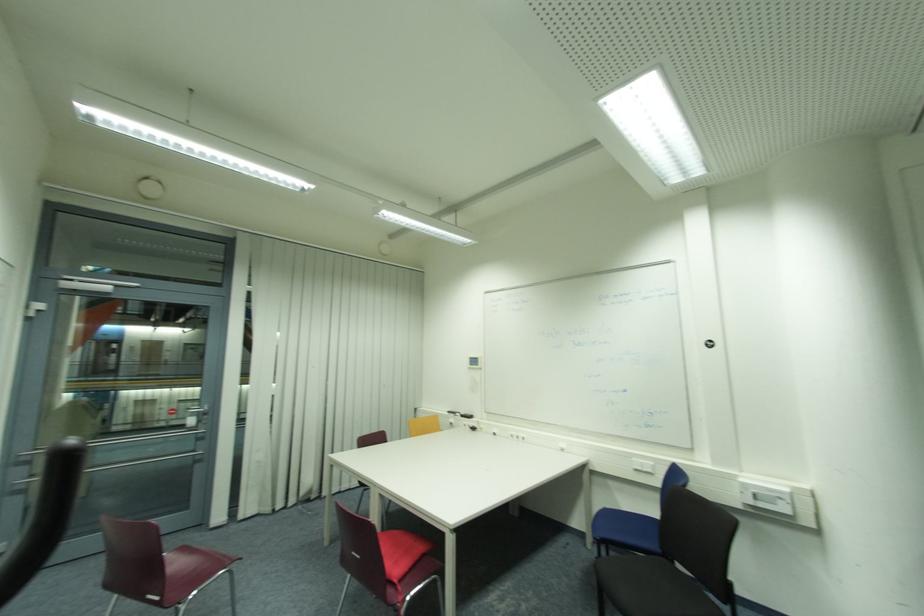
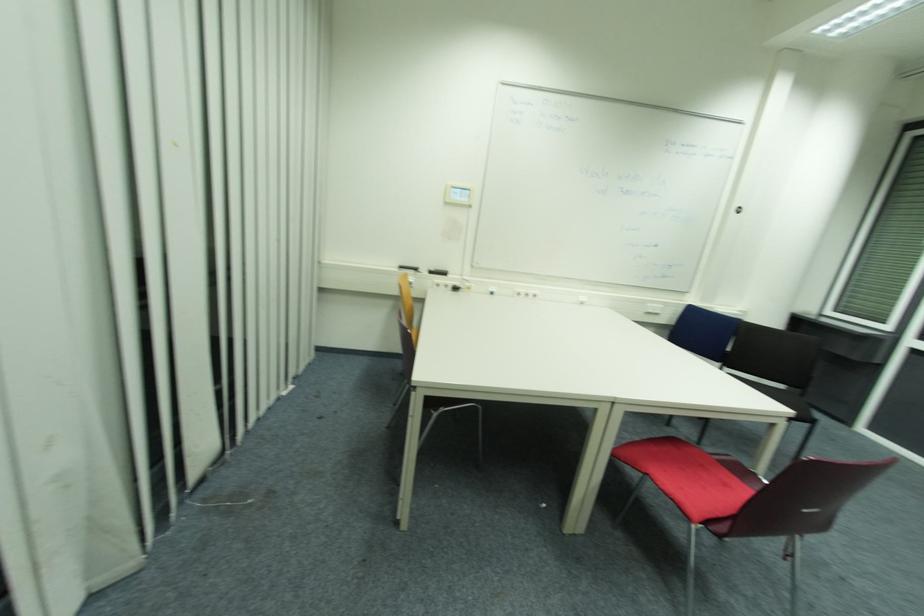
Locate, in the second image, the point that corresponds to point (521, 438) in the first image.

(529, 294)